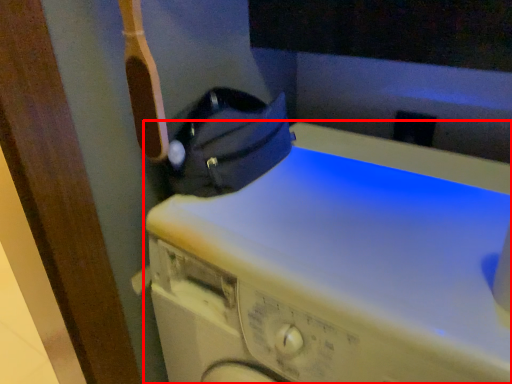
Question: From the image's perspective, where is washing machine (annotated by the red box) located in relation to bag in the image?

Choices:
 (A) above
 (B) below

Answer: (B)